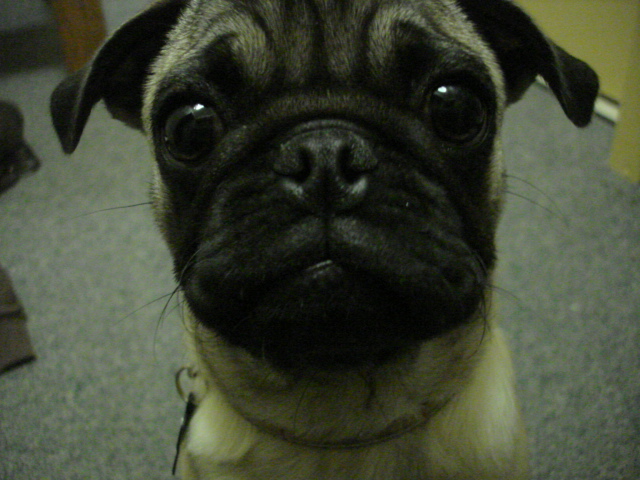
This screenshot has height=480, width=640. Identify the location of gray carpet. (585, 352).